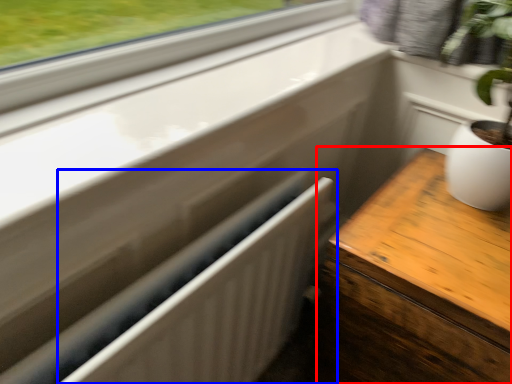
Question: Which of the following is the farthest to the observer, table (highlighted by a red box) or radiator (highlighted by a blue box)?

Choices:
 (A) table
 (B) radiator

Answer: (A)